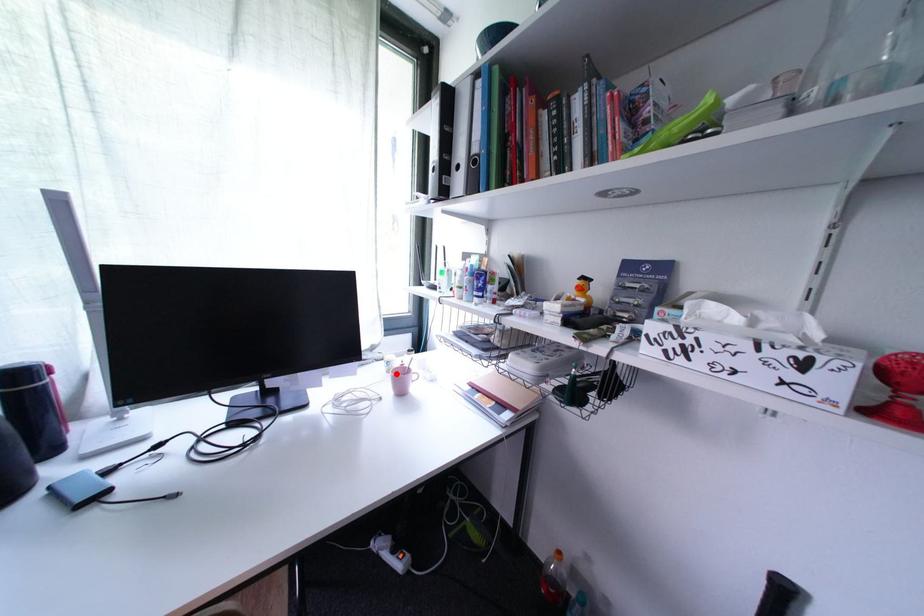
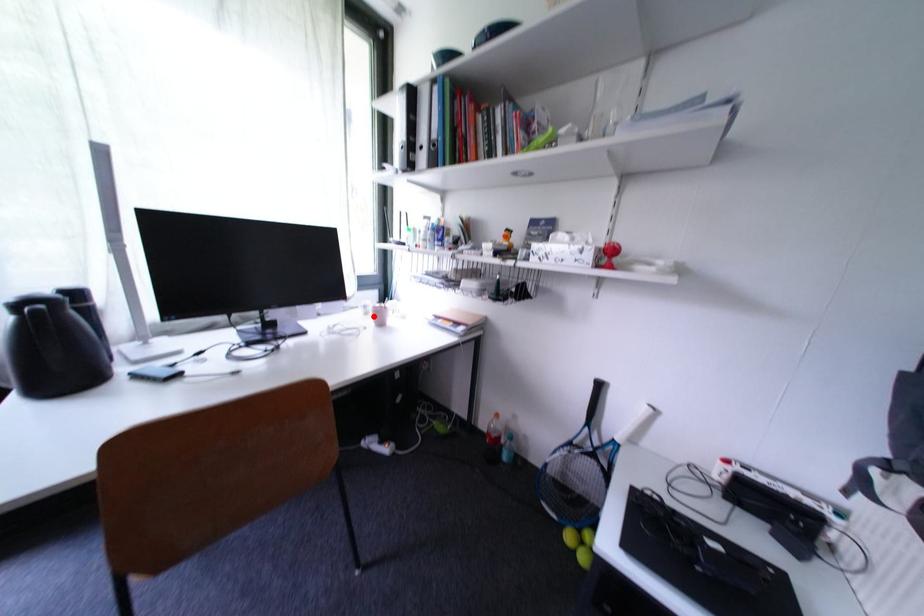
I am providing you with two images of the same scene from different viewpoints. A red point is marked on the first image and another point is marked on the second image. Are the points marked in image1 and image2 representing the same 3D position?

Yes